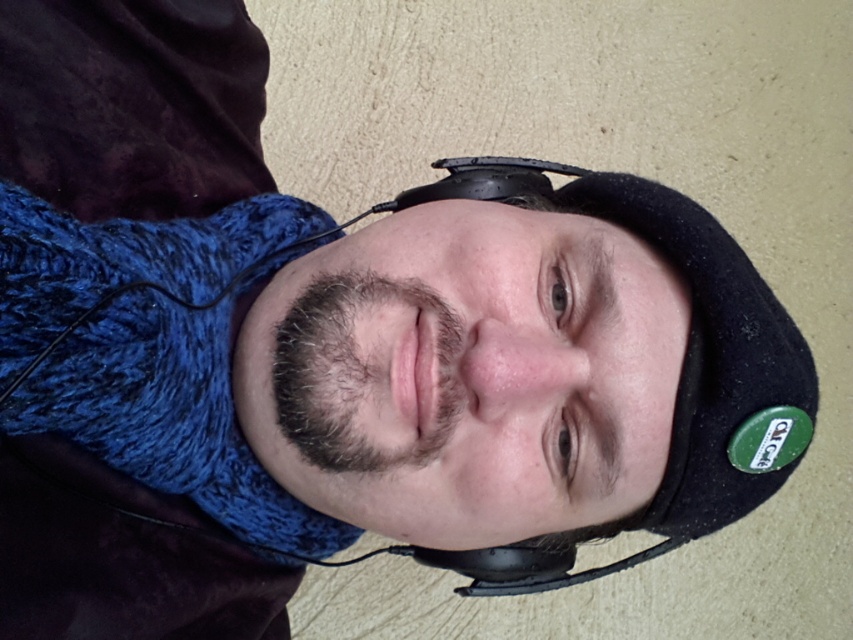
Find the location of `black felt hat at center`. black felt hat at center is located at coordinates (683, 394).

Between black felt hat at center and black matte headphones at center, which one is positioned higher?

black matte headphones at center

Who is more forward, (x=695, y=538) or (x=540, y=195)?

Point (x=695, y=538) is in front.

You are a GUI agent. You are given a task and a screenshot of the screen. Output one action in this format:
    pyautogui.click(x=<x>, y=<y>)
    Task: Click on the black felt hat at center
    The height and width of the screenshot is (640, 853).
    Given the screenshot: What is the action you would take?
    pyautogui.click(x=683, y=394)

Is black felt hat at center closer to the viewer compared to dark brown fuzzy beard at center?

A: No.

Does black felt hat at center have a smaller size compared to dark brown fuzzy beard at center?

No, black felt hat at center is not smaller than dark brown fuzzy beard at center.

This screenshot has width=853, height=640. What are the coordinates of `black felt hat at center` in the screenshot? It's located at (683, 394).

Which is above, dark brown fuzzy beard at center or black matte headphones at center?

black matte headphones at center

Does dark brown fuzzy beard at center appear under black matte headphones at center?

Yes, dark brown fuzzy beard at center is below black matte headphones at center.

Who is more distant from viewer, (317, 300) or (480, 173)?

Positioned behind is point (480, 173).

What are the coordinates of `dark brown fuzzy beard at center` in the screenshot? It's located at (361, 372).